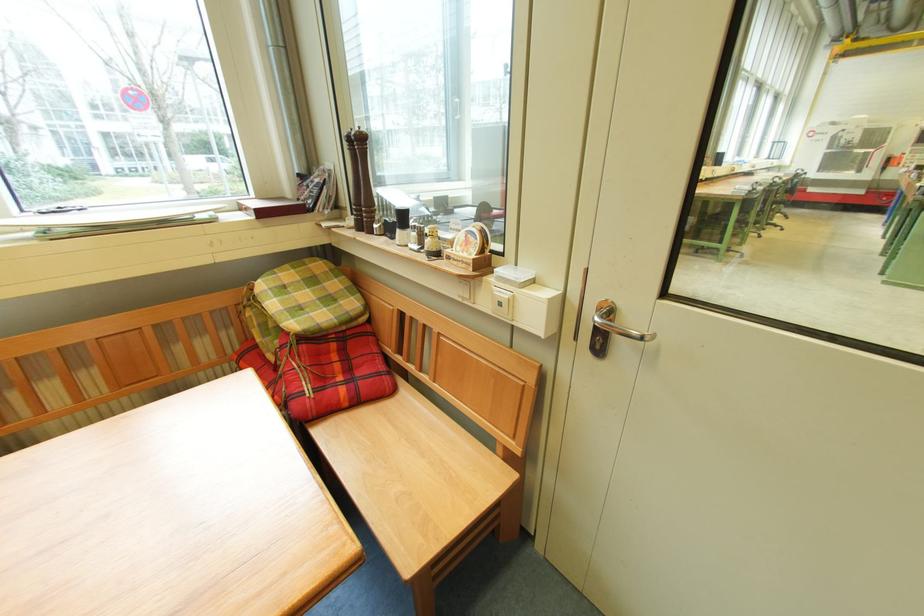
Where would you turn the silver door handle? Please return your answer as a coordinate pair (x, y).

(621, 328)